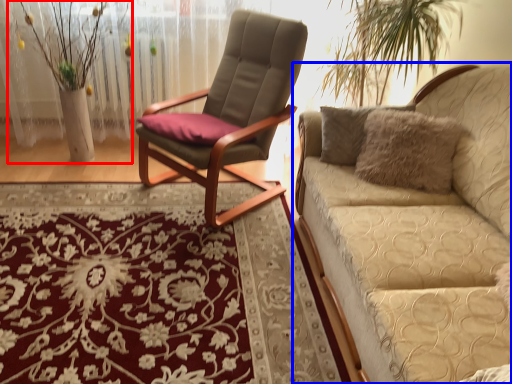
Question: Which object is closer to the camera taking this photo, floral arrangement (highlighted by a red box) or studio couch (highlighted by a blue box)?

Choices:
 (A) floral arrangement
 (B) studio couch

Answer: (B)